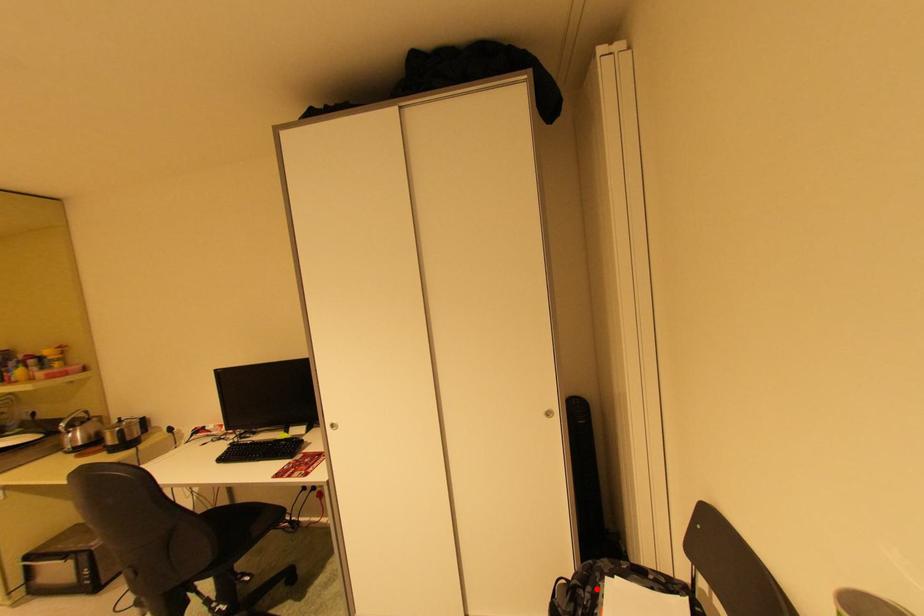
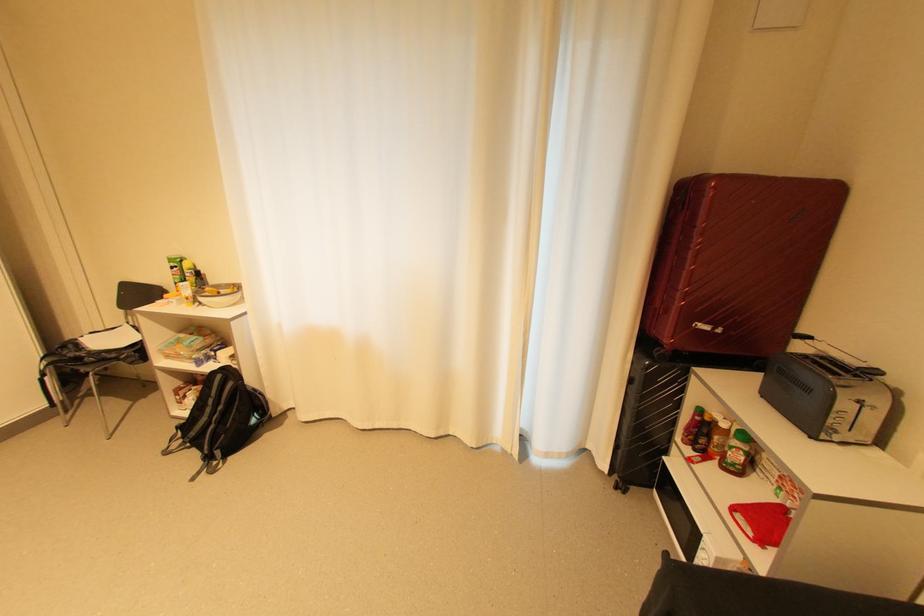
Question: I am providing you with two images of the same scene from different viewpoints. A red point is shown in image1. For the corresponding object point in image2, is it positioned nearer or farther from the camera?

Choices:
 (A) Nearer
 (B) Farther

Answer: (A)